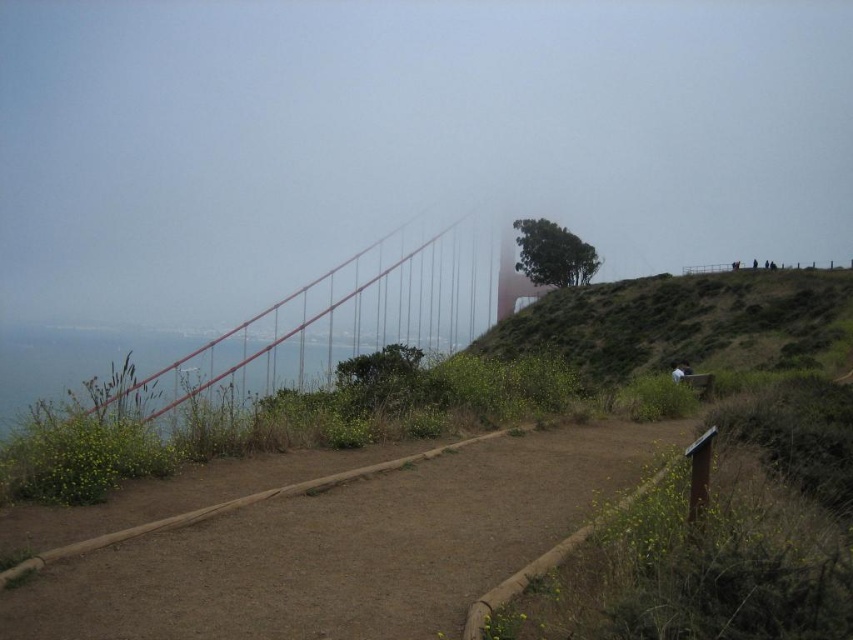
Does brown dirt path at center appear on the right side of green leafy tree at upper center?

In fact, brown dirt path at center is to the left of green leafy tree at upper center.

Which is more to the left, brown dirt path at center or green leafy tree at upper center?

Positioned to the left is brown dirt path at center.

The height and width of the screenshot is (640, 853). What do you see at coordinates (347, 548) in the screenshot?
I see `brown dirt path at center` at bounding box center [347, 548].

You are a GUI agent. You are given a task and a screenshot of the screen. Output one action in this format:
    pyautogui.click(x=<x>, y=<y>)
    Task: Click on the brown dirt path at center
    The height and width of the screenshot is (640, 853).
    Given the screenshot: What is the action you would take?
    pyautogui.click(x=347, y=548)

Between point (96, 570) and point (750, 360), which one is positioned in front?

Positioned in front is point (96, 570).

Is brown dirt path at center closer to the viewer compared to green grassy hillside at upper right?

That is True.

Who is more distant from viewer, (410, 513) or (525, 323)?

Positioned behind is point (525, 323).

Locate an element on the screen. This screenshot has height=640, width=853. brown dirt path at center is located at coordinates (347, 548).

Does brown dirt path at center have a lesser height compared to metallic red suspension bridge at center?

Yes, brown dirt path at center is shorter than metallic red suspension bridge at center.

Can you confirm if brown dirt path at center is positioned to the left of metallic red suspension bridge at center?

Incorrect, brown dirt path at center is not on the left side of metallic red suspension bridge at center.

Who is more distant from viewer, (x=68, y=602) or (x=323, y=332)?

The point (x=323, y=332) is more distant.

Find the location of a particular element. Image resolution: width=853 pixels, height=640 pixels. brown dirt path at center is located at coordinates (347, 548).